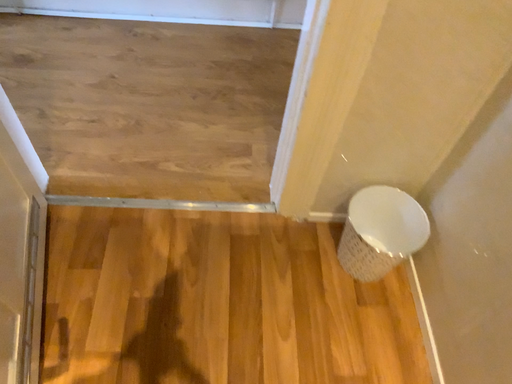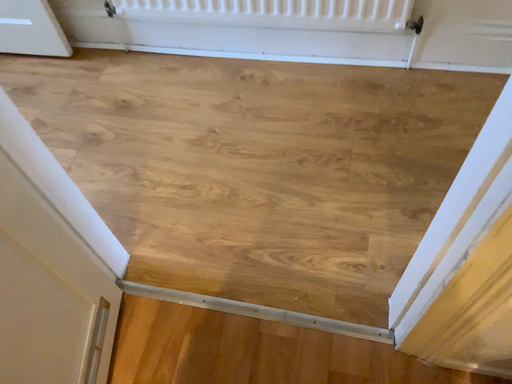
Question: How did the camera likely rotate when shooting the video?

Choices:
 (A) rotated left
 (B) rotated right

Answer: (A)